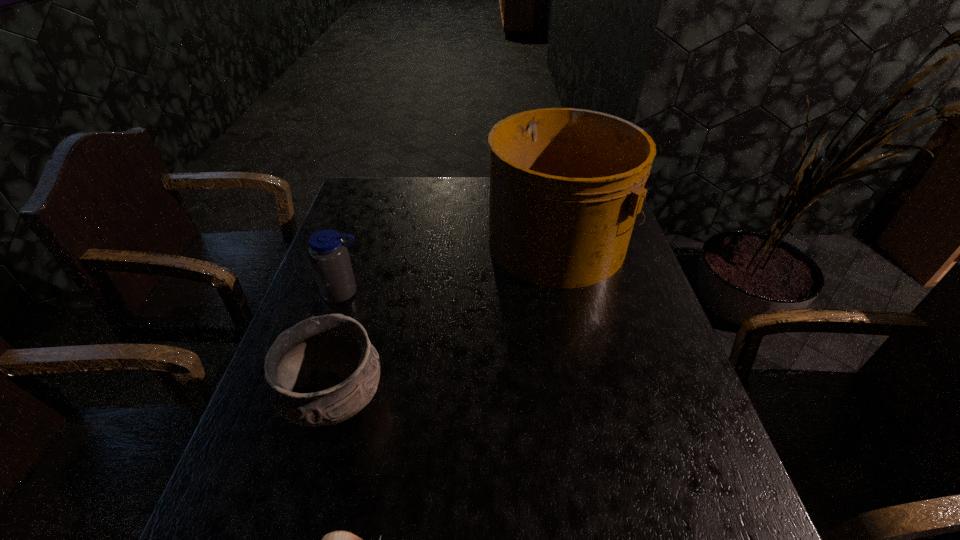
Identify the location of the tallest object. This screenshot has height=540, width=960. (566, 184).

Where is `bucket`? Image resolution: width=960 pixels, height=540 pixels. bucket is located at coordinates (566, 184).

Identify the location of water bottle. (328, 254).

Find the location of `the second nearest object`. the second nearest object is located at coordinates (323, 370).

At what (x,y) coordinates should I click in order to perform the action: click on vacant space situated on the front of the bucket. Please return your answer as a coordinate pair (x, y). The image size is (960, 540). Looking at the image, I should click on (576, 326).

At what (x,y) coordinates should I click in order to perform the action: click on vacant space located 0.060m with a carrying loop on the side of the water bottle. Please return your answer as a coordinate pair (x, y). The height and width of the screenshot is (540, 960). Looking at the image, I should click on (334, 322).

This screenshot has height=540, width=960. I want to click on vacant space located on the right of the pottery, so click(x=447, y=401).

This screenshot has width=960, height=540. What are the coordinates of `object located at the far edge` in the screenshot? It's located at click(566, 184).

Locate an element on the screen. The width and height of the screenshot is (960, 540). water bottle that is at the left edge is located at coordinates (328, 254).

The height and width of the screenshot is (540, 960). Find the location of `pottery located at the left edge`. pottery located at the left edge is located at coordinates (323, 370).